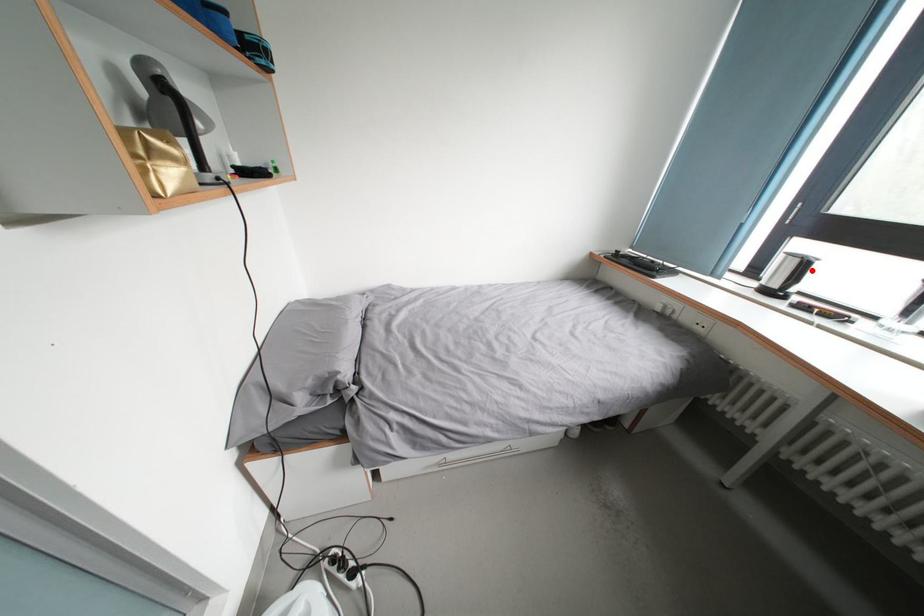
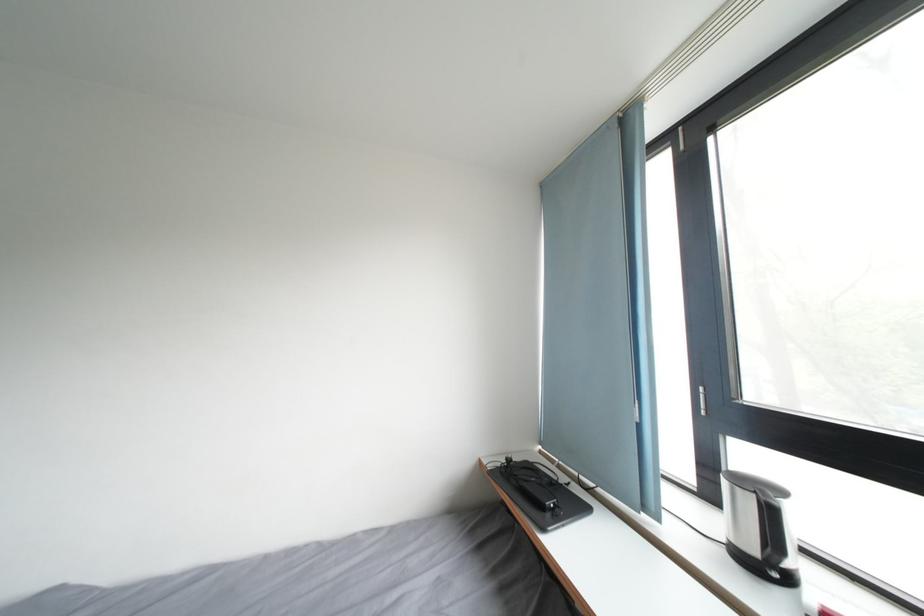
Question: A red point is marked in image1. In image2, is the corresponding 3D point closer to the camera or farther? Reply with the corresponding letter.

Choices:
 (A) The corresponding 3D point is closer.
 (B) The corresponding 3D point is farther.

Answer: (A)